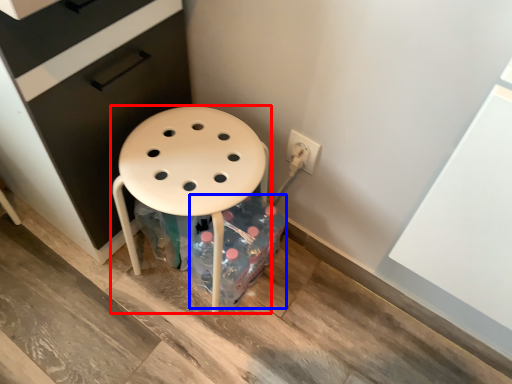
Question: Which point is further to the camera, stool (highlighted by a red box) or bottle (highlighted by a blue box)?

Choices:
 (A) stool
 (B) bottle

Answer: (B)